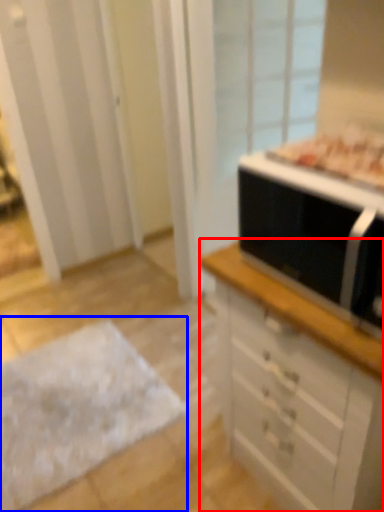
Question: Which object is further to the camera taking this photo, chest of drawers (highlighted by a red box) or flat (highlighted by a blue box)?

Choices:
 (A) chest of drawers
 (B) flat

Answer: (B)